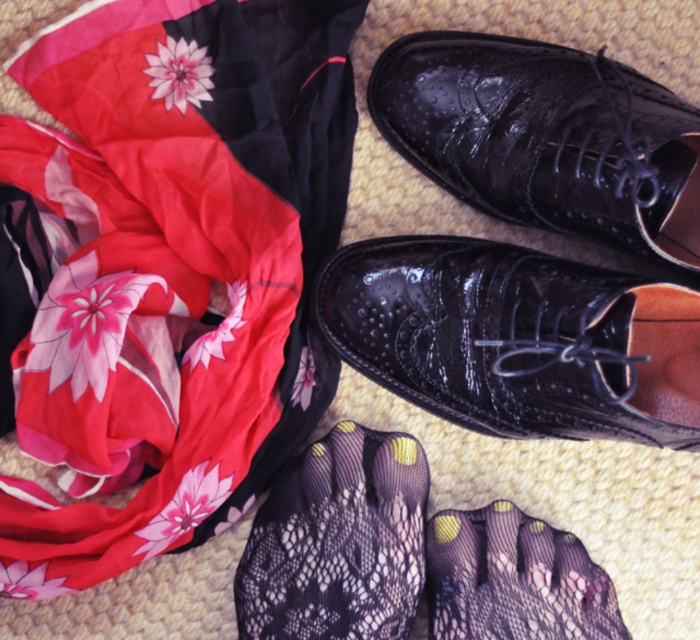
Question: Which of the following is the farthest from the observer?

Choices:
 (A) glossy patent leather shoe at center
 (B) glossy leather shoe at center

Answer: (A)

Question: Does glossy patent leather shoe at center appear under black lace foot at lower right?

Choices:
 (A) no
 (B) yes

Answer: (A)

Question: Can you confirm if glossy leather shoe at center is wider than glossy patent leather shoe at center?

Choices:
 (A) yes
 (B) no

Answer: (A)

Question: Which point is closer to the camera taking this photo?

Choices:
 (A) (455, 598)
 (B) (475, 125)

Answer: (A)

Question: Estimate the real-world distances between objects in this image. Which object is farther from the glossy leather shoe at center?

Choices:
 (A) glossy patent leather shoe at center
 (B) black mesh sock at lower center
 (C) floral silk scarf at upper left

Answer: (C)

Question: Is floral silk scarf at upper left thinner than black mesh sock at lower center?

Choices:
 (A) yes
 (B) no

Answer: (B)